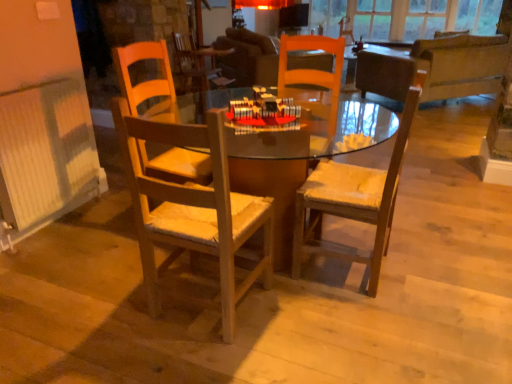
Question: Is wooden chair with cushion at center, which is the first chair from right to left, aimed at dark brown leather couch at upper right?

Choices:
 (A) yes
 (B) no

Answer: (B)

Question: Is wooden chair with cushion at center, which is counted as the second chair, starting from the left, looking in the opposite direction of dark brown leather couch at upper right?

Choices:
 (A) no
 (B) yes

Answer: (A)

Question: Does wooden chair with cushion at center, which is the first chair from right to left, have a greater width compared to dark brown leather couch at upper right?

Choices:
 (A) no
 (B) yes

Answer: (A)

Question: From the image's perspective, does wooden chair with cushion at center, which is counted as the second chair, starting from the left, appear lower than dark brown leather couch at upper right?

Choices:
 (A) yes
 (B) no

Answer: (A)

Question: Does wooden chair with cushion at center, which is the first chair from right to left, contain dark brown leather couch at upper right?

Choices:
 (A) no
 (B) yes

Answer: (A)

Question: In the image, is wooden chair at center, which ranks as the second chair in right-to-left order, positioned in front of or behind wooden chair with cushion at center, which is the first chair from right to left?

Choices:
 (A) front
 (B) behind

Answer: (A)

Question: In terms of height, does wooden chair at center, the 1th chair viewed from the left, look taller or shorter compared to wooden chair with cushion at center, which is counted as the second chair, starting from the left?

Choices:
 (A) tall
 (B) short

Answer: (B)

Question: Is wooden chair at center, which ranks as the second chair in right-to-left order, wider or thinner than wooden chair with cushion at center, which is counted as the second chair, starting from the left?

Choices:
 (A) wide
 (B) thin

Answer: (B)

Question: From the image's perspective, is wooden chair at center, which ranks as the second chair in right-to-left order, located above or below wooden chair with cushion at center, which is the first chair from right to left?

Choices:
 (A) above
 (B) below

Answer: (B)

Question: Is wooden chair with cushion at center, which is the first chair from right to left, wider or thinner than white ribbed radiator at left?

Choices:
 (A) thin
 (B) wide

Answer: (B)

Question: Visually, is wooden chair with cushion at center, which is counted as the second chair, starting from the left, positioned to the left or to the right of white ribbed radiator at left?

Choices:
 (A) right
 (B) left

Answer: (A)

Question: Is point (395, 142) closer or farther from the camera than point (91, 168)?

Choices:
 (A) closer
 (B) farther

Answer: (A)

Question: Relative to white ribbed radiator at left, is wooden chair with cushion at center, which is counted as the second chair, starting from the left, in front or behind?

Choices:
 (A) behind
 (B) front

Answer: (B)

Question: Considering the positions of dark brown leather couch at upper right and wooden chair with cushion at center, which is counted as the second chair, starting from the left, in the image, is dark brown leather couch at upper right bigger or smaller than wooden chair with cushion at center, which is counted as the second chair, starting from the left,?

Choices:
 (A) small
 (B) big

Answer: (B)

Question: Choose the correct answer: Is dark brown leather couch at upper right inside wooden chair with cushion at center, which is the first chair from right to left, or outside it?

Choices:
 (A) outside
 (B) inside

Answer: (A)